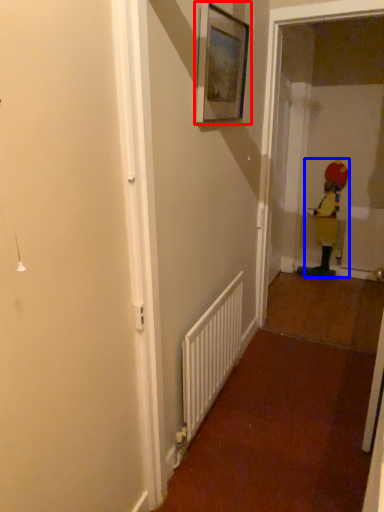
Question: Which object is closer to the camera taking this photo, picture frame (highlighted by a red box) or toddler (highlighted by a blue box)?

Choices:
 (A) picture frame
 (B) toddler

Answer: (A)